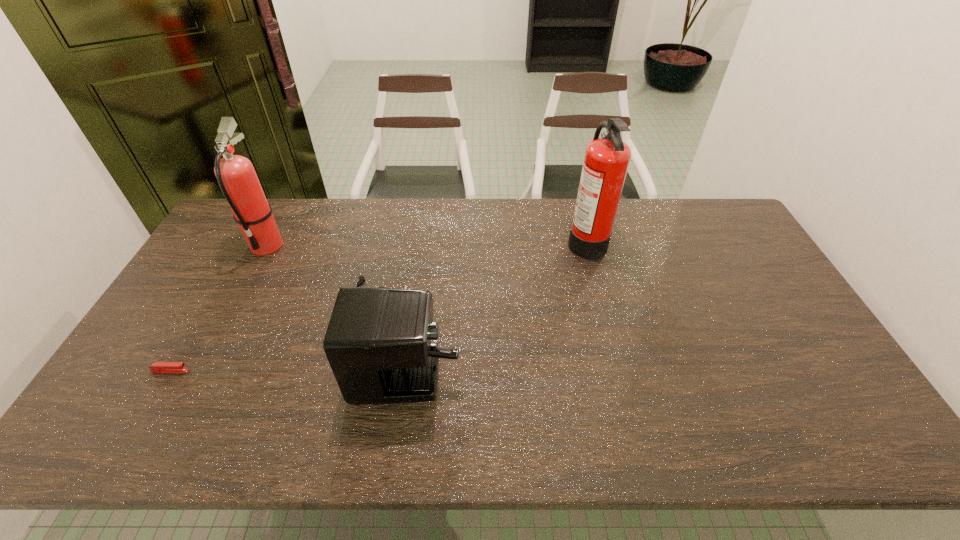
Where is `the right fire extinguisher`? the right fire extinguisher is located at coordinates (606, 160).

Locate an element on the screen. the left fire extinguisher is located at coordinates (236, 176).

The image size is (960, 540). I want to click on the second shortest object, so click(x=378, y=342).

At what (x,y) coordinates should I click in order to perform the action: click on coffee maker. Please return your answer as a coordinate pair (x, y). Looking at the image, I should click on (378, 342).

At what (x,y) coordinates should I click in order to perform the action: click on stapler. Please return your answer as a coordinate pair (x, y). Looking at the image, I should click on (158, 367).

Image resolution: width=960 pixels, height=540 pixels. Find the location of `vacant space located on the front-facing side of the right fire extinguisher`. vacant space located on the front-facing side of the right fire extinguisher is located at coordinates (473, 240).

In order to click on blank space located on the front-facing side of the right fire extinguisher in this screenshot , I will do `click(479, 240)`.

This screenshot has height=540, width=960. Identify the location of vacant region located 0.310m on the front-facing side of the right fire extinguisher. (476, 240).

Where is `vacant space located on the hose direction of the left fire extinguisher`? The height and width of the screenshot is (540, 960). vacant space located on the hose direction of the left fire extinguisher is located at coordinates (239, 299).

This screenshot has width=960, height=540. Find the location of `free space located 0.050m on the front-facing side of the third tallest object`. free space located 0.050m on the front-facing side of the third tallest object is located at coordinates (480, 334).